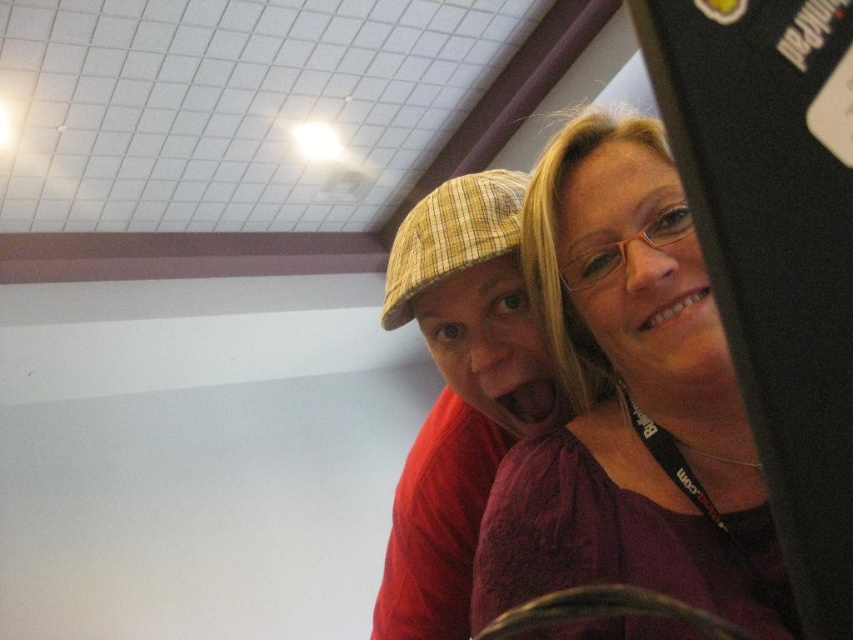
Does matte purple blouse at upper right have a greater width compared to black glossy monitor at upper right?

Indeed, matte purple blouse at upper right has a greater width compared to black glossy monitor at upper right.

Is matte purple blouse at upper right above black glossy monitor at upper right?

Actually, matte purple blouse at upper right is below black glossy monitor at upper right.

You are a GUI agent. You are given a task and a screenshot of the screen. Output one action in this format:
    pyautogui.click(x=<x>, y=<y>)
    Task: Click on the matte purple blouse at upper right
    The height and width of the screenshot is (640, 853).
    Given the screenshot: What is the action you would take?
    pyautogui.click(x=630, y=401)

Does black glossy monitor at upper right appear on the right side of plaid fabric cap at center?

Yes, black glossy monitor at upper right is to the right of plaid fabric cap at center.

Where is `black glossy monitor at upper right`? This screenshot has width=853, height=640. black glossy monitor at upper right is located at coordinates (775, 246).

I want to click on black glossy monitor at upper right, so click(x=775, y=246).

How much distance is there between matte purple blouse at upper right and plaid fabric cap at center?

matte purple blouse at upper right is 7.62 inches away from plaid fabric cap at center.

Does matte purple blouse at upper right have a lesser width compared to plaid fabric cap at center?

Indeed, matte purple blouse at upper right has a lesser width compared to plaid fabric cap at center.

Who is more distant from viewer, (x=596, y=484) or (x=438, y=440)?

Positioned behind is point (x=438, y=440).

Image resolution: width=853 pixels, height=640 pixels. Find the location of `matte purple blouse at upper right`. matte purple blouse at upper right is located at coordinates (630, 401).